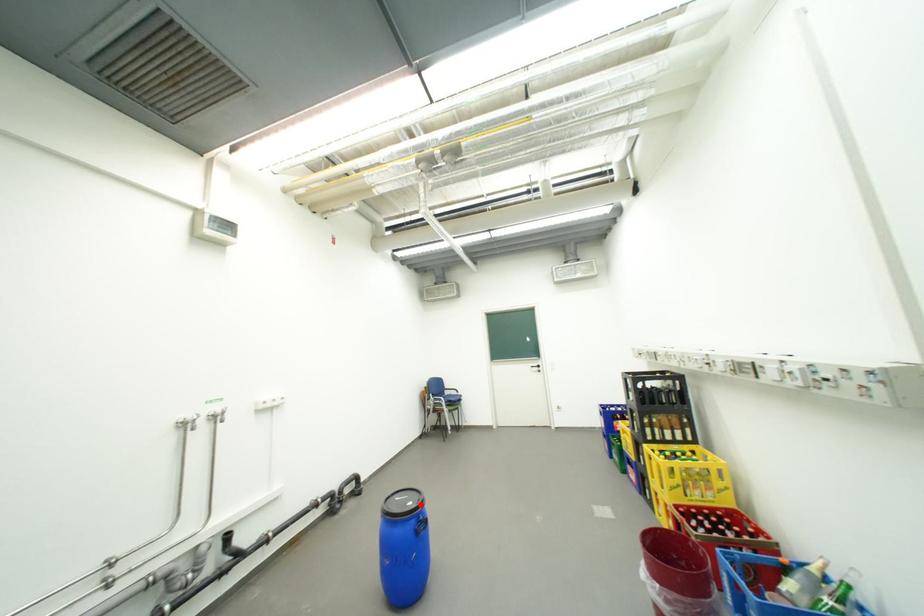
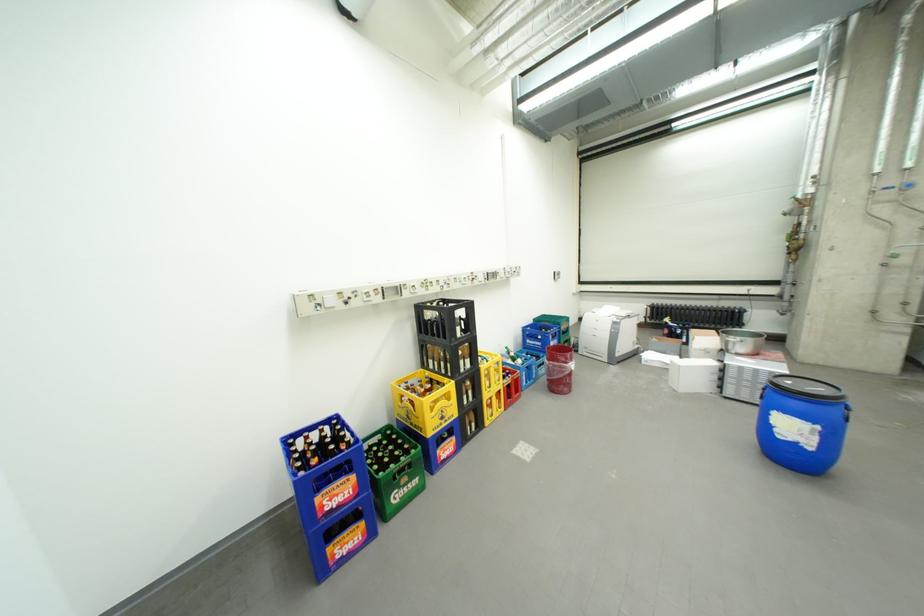
The point at the highlighted location is marked in the first image. Where is the corresponding point in the second image?

(799, 383)